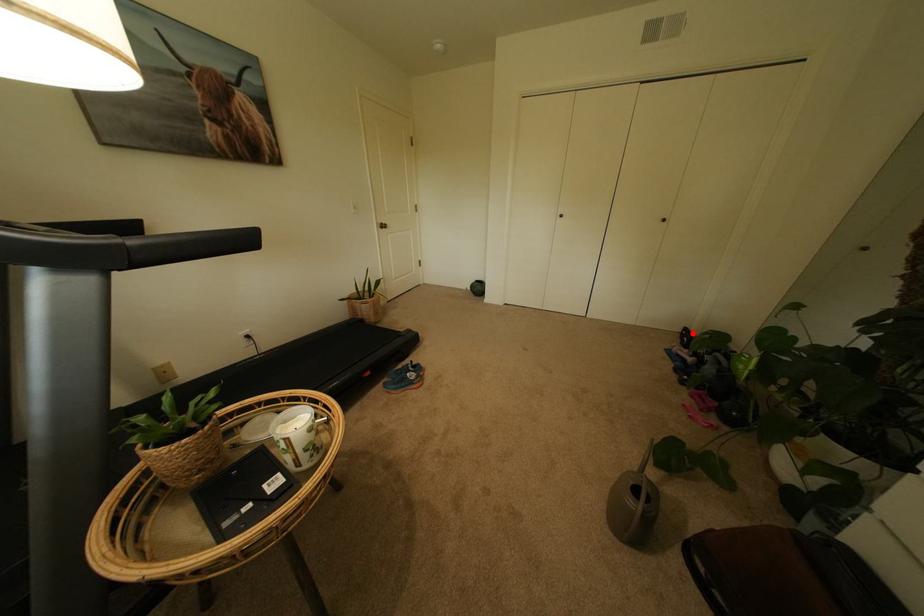
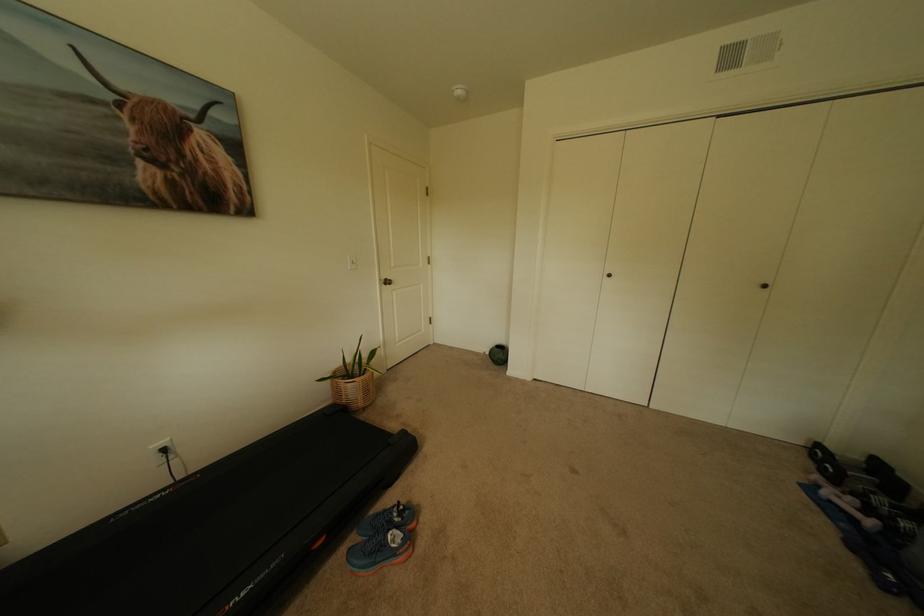
Question: I am providing you with two images of the same scene from different viewpoints. Given a red point in image1, look at the same physical point in image2. Is it:

Choices:
 (A) Closer to the viewpoint
 (B) Farther from the viewpoint

Answer: (B)